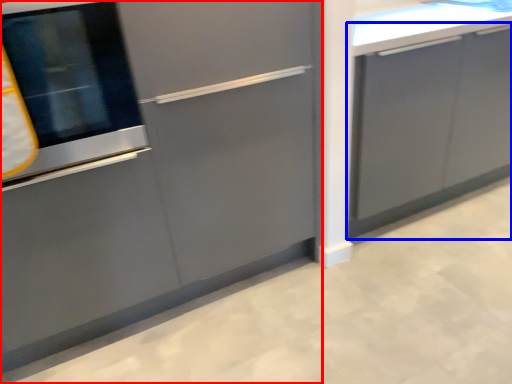
Question: Which object is closer to the camera taking this photo, cabinetry (highlighted by a red box) or cabinetry (highlighted by a blue box)?

Choices:
 (A) cabinetry
 (B) cabinetry

Answer: (A)